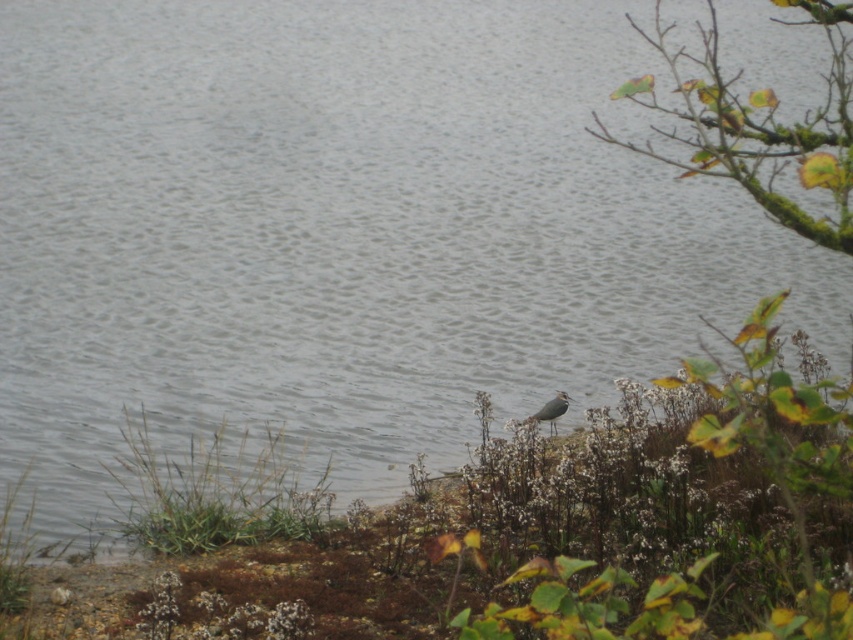
Question: Can you confirm if green mossy branch at upper right is thinner than grayish-brown feathers at lower center?

Choices:
 (A) no
 (B) yes

Answer: (A)

Question: Where is green mossy branch at upper right located in relation to grayish-brown feathers at lower center in the image?

Choices:
 (A) below
 (B) above

Answer: (B)

Question: Where is green mossy branch at upper right located in relation to grayish-brown feathers at lower center in the image?

Choices:
 (A) below
 (B) above

Answer: (B)

Question: Which of the following is the farthest from the observer?

Choices:
 (A) grayish-brown feathers at lower center
 (B) green mossy branch at upper right

Answer: (A)